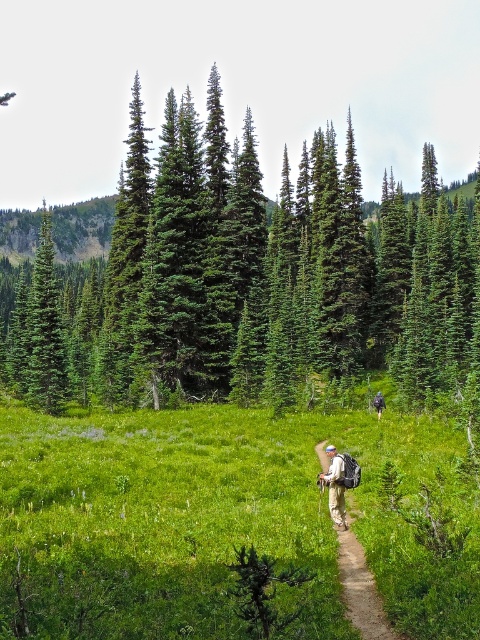
You are a hiker standing on the green grassy field at center. Looking ahead, you see the green evergreen tree at center. Which direction is the tree relative to your current position?

The green evergreen tree at center is located above the green grassy field at center, so it is positioned higher in elevation relative to your current position on the field.

You are a photographer trying to capture the hiker in the scene. The khaki cotton pants at center and camouflage backpack at center are both in focus. Which object is bigger in your photo?

The khaki cotton pants at center is larger in size compared to the camouflage backpack at center, so it will appear bigger in the photo.

You are a hiker trying to locate your backpack while on a mountain trail. You remember placing a marker at point coordinates (360, 589). According to the image, where is this point located?

The point is located on the tan fabric backpack at center.